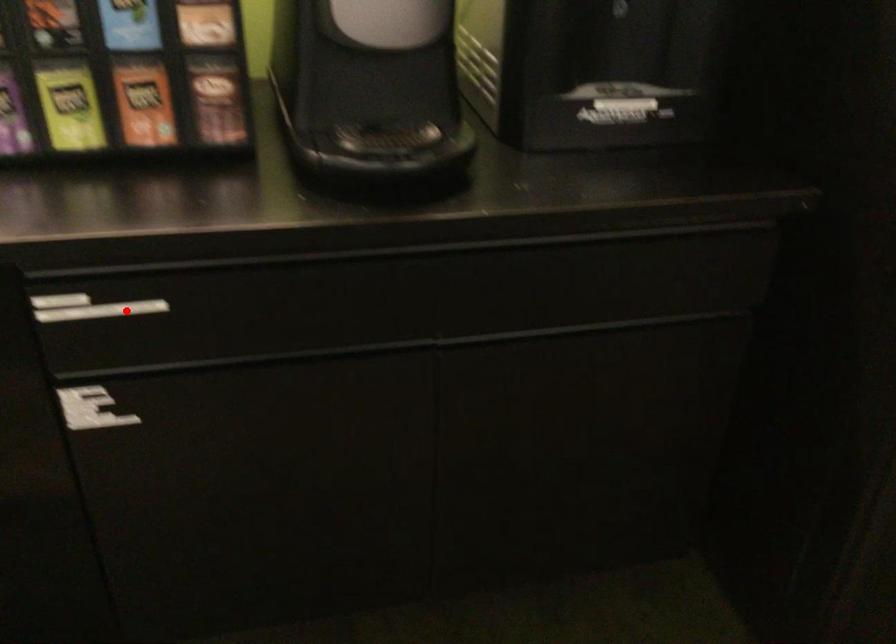
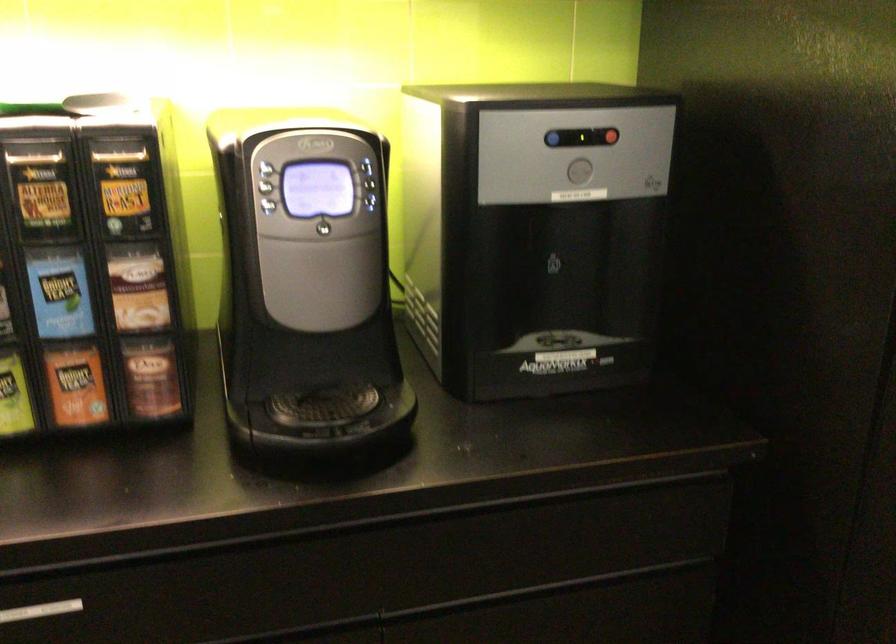
In the second image, find the point that corresponds to the highlighted location in the first image.

(40, 611)